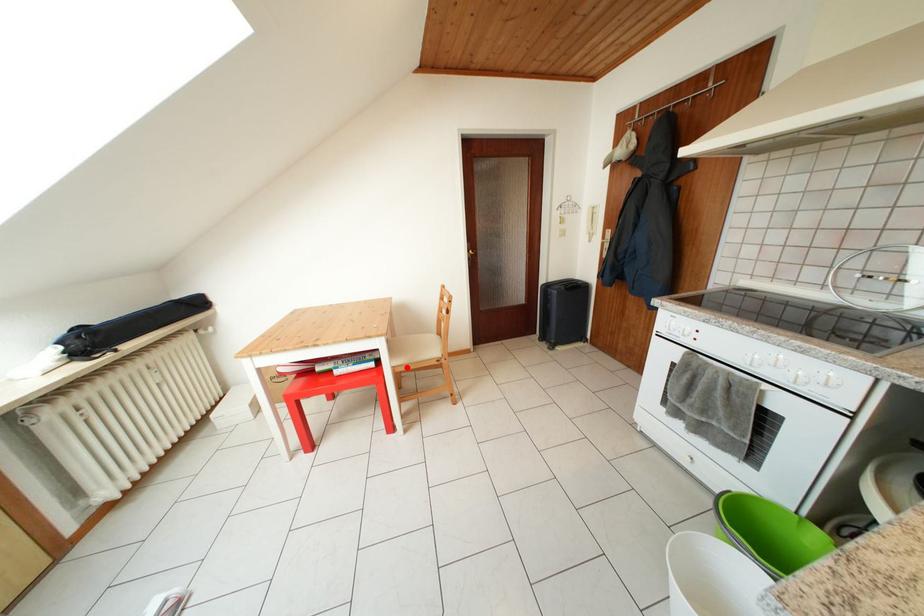
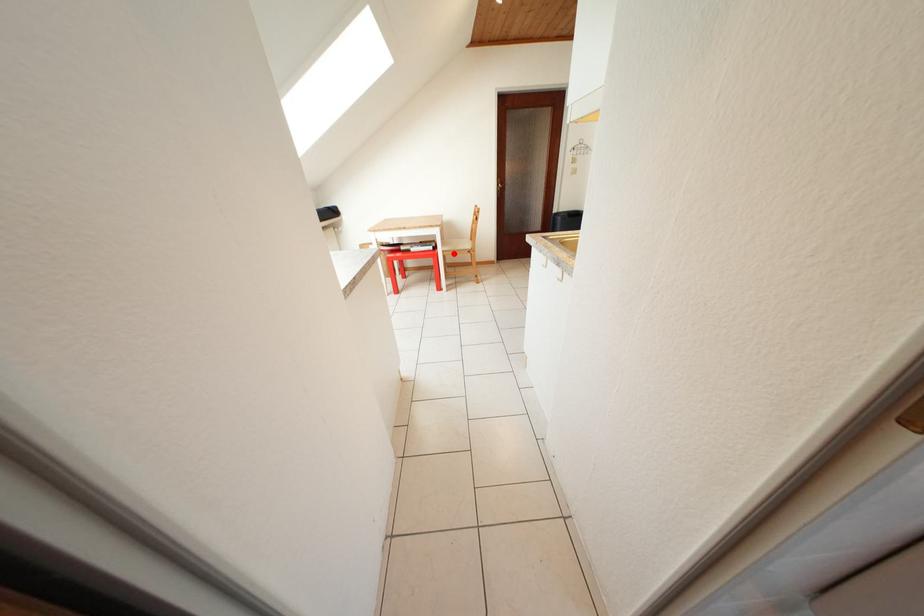
Looking at this image, I am providing you with two images of the same scene from different viewpoints. A red point is marked on the first image and another point is marked on the second image. Is the marked point in image1 the same physical position as the marked point in image2?

Yes